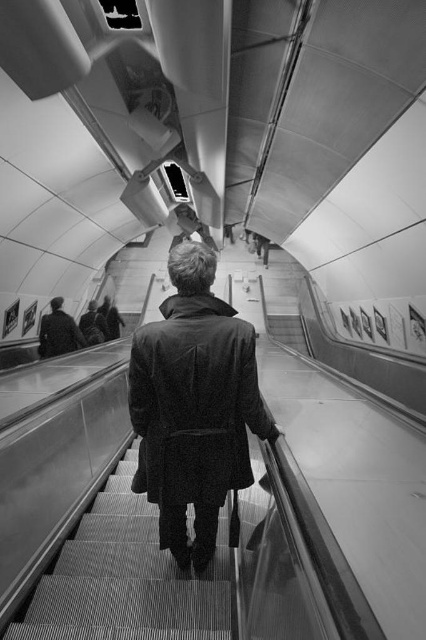
Question: Which point appears farthest from the camera in this image?

Choices:
 (A) (65, 344)
 (B) (213, 612)
 (C) (253, 353)

Answer: (A)

Question: Which object is farther from the camera taking this photo?

Choices:
 (A) textured carpet stairs at center
 (B) dark wool coat at center
 (C) dark gray coat at upper center

Answer: (C)

Question: Is the position of dark wool coat at center more distant than that of textured carpet stairs at center?

Choices:
 (A) yes
 (B) no

Answer: (B)

Question: Can you confirm if dark wool coat at center is positioned to the right of textured carpet stairs at center?

Choices:
 (A) no
 (B) yes

Answer: (B)

Question: Does textured carpet stairs at center have a larger size compared to dark gray coat at upper center?

Choices:
 (A) yes
 (B) no

Answer: (B)

Question: Which object is closer to the camera taking this photo?

Choices:
 (A) dark gray coat at upper center
 (B) dark wool coat at center

Answer: (B)